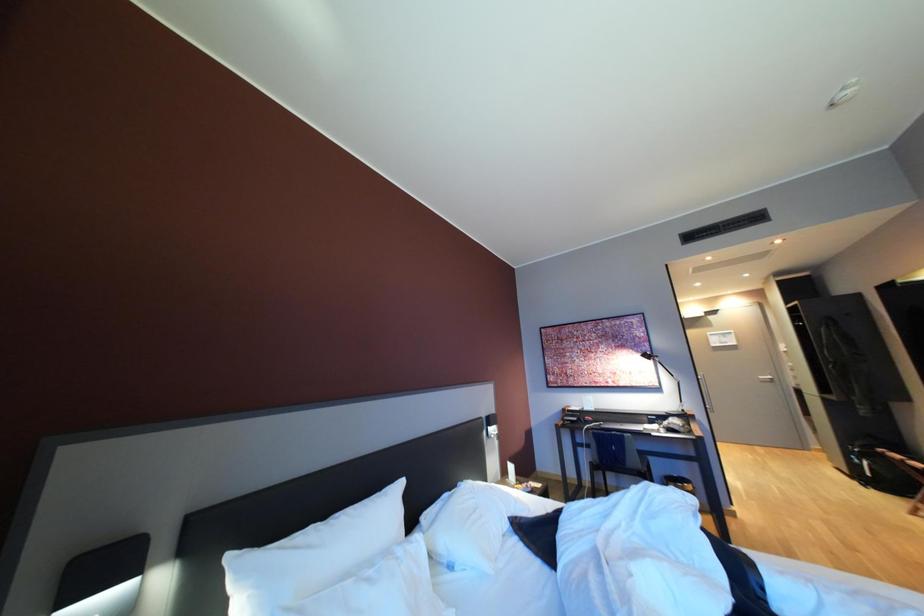
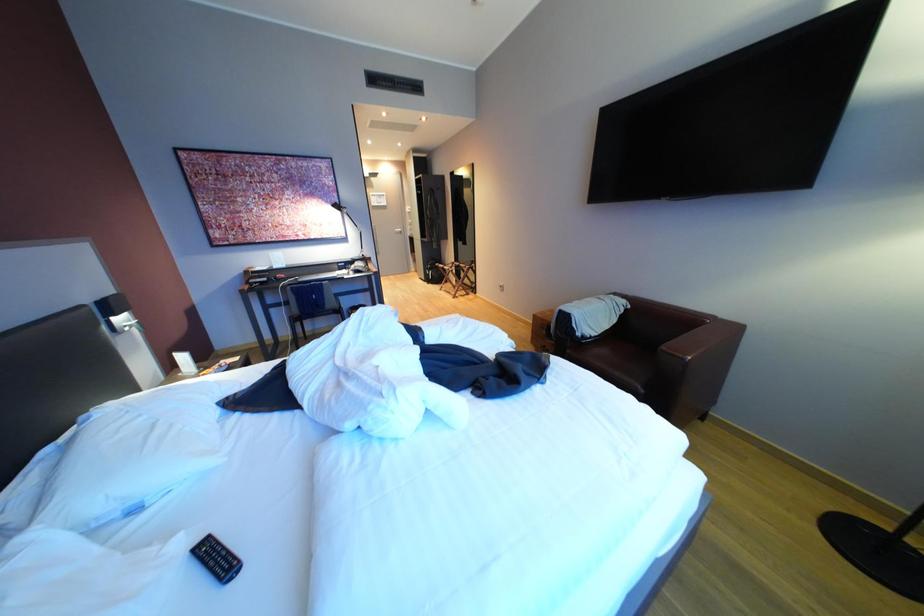
The images are taken continuously from a first-person perspective. In which direction is your viewpoint rotating?

The rotation direction of the camera is right-down.